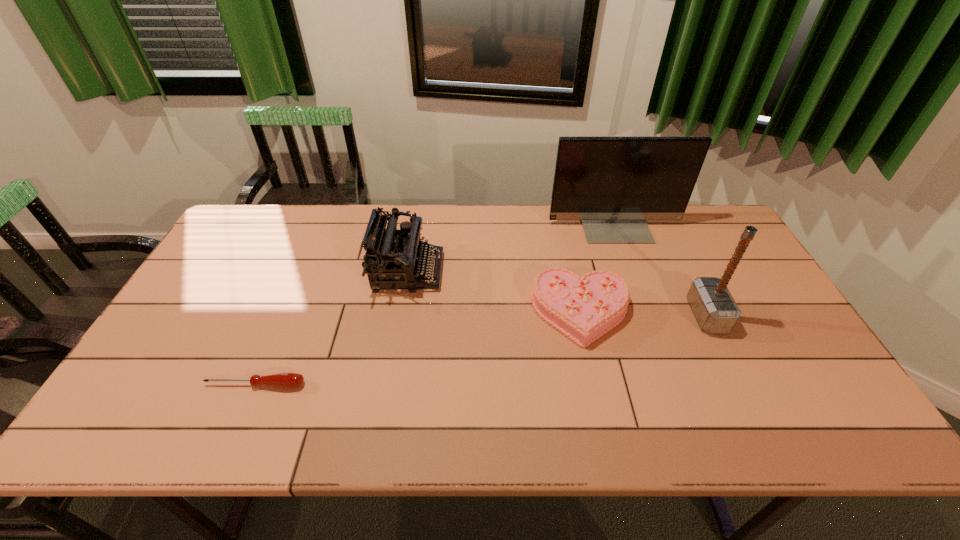
The width and height of the screenshot is (960, 540). What are the coordinates of `vacant space at the left edge of the desktop` in the screenshot? It's located at (207, 336).

Find the location of a particular element. free space at the far left corner is located at coordinates (257, 206).

This screenshot has width=960, height=540. I want to click on free area in between the second shortest object and the hammer, so click(x=644, y=314).

This screenshot has width=960, height=540. I want to click on unoccupied area between the computer monitor and the hammer, so click(660, 269).

This screenshot has width=960, height=540. Identify the location of free space between the hammer and the cake. tap(644, 314).

Identify the location of free space that is in between the nearest object and the fourth object from right to left. The height and width of the screenshot is (540, 960). (331, 328).

I want to click on empty space that is in between the hammer and the computer monitor, so click(x=660, y=269).

Identify the location of vacant space in between the cake and the screwdriver. (419, 349).

In order to click on free space between the cake and the fourth object from right to left in this screenshot , I will do click(494, 292).

At what (x,y) coordinates should I click in order to perform the action: click on blank region between the fourth object from right to left and the screwdriver. Please return your answer as a coordinate pair (x, y). This screenshot has width=960, height=540. Looking at the image, I should click on (331, 328).